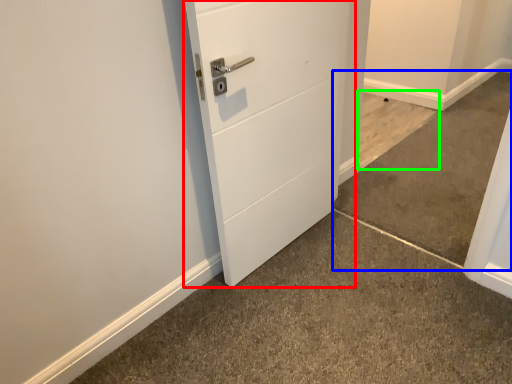
Question: Which object is the farthest from door (highlighted by a red box)? Choose among these: concrete (highlighted by a blue box) or concrete (highlighted by a green box).

Choices:
 (A) concrete
 (B) concrete

Answer: (B)